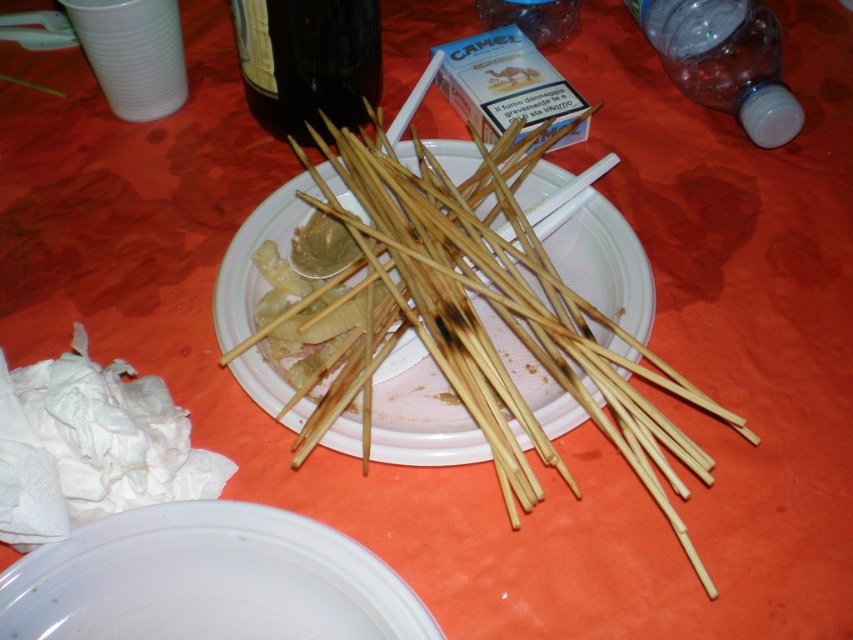
You are at a party and need to place both the bamboo skewers at center and the dark glass bottle at center on a shelf that can only hold items up to the width of the dark glass bottle. Can you fit both items on the shelf?

The bamboo skewers at center are wider than the dark glass bottle at center. Since the shelf can only hold items up to the width of the dark glass bottle, the bamboo skewers at center would not fit. Only the dark glass bottle at center can be placed on the shelf.

You are at a picnic and need to grab a drink. You see the bamboo skewers at center and the transparent plastic bottle at upper center. Which item is closer to you?

The bamboo skewers at center are closer to the viewer than the transparent plastic bottle at upper center, so you can reach the bamboo skewers at center first.

You are at a party and need to choose a bottle to carry drinks. Which one is taller between the dark glass bottle at center and the transparent plastic bottle at upper center?

The dark glass bottle at center is much taller than the transparent plastic bottle at upper center, so you should choose the dark glass bottle at center if you want a taller bottle.